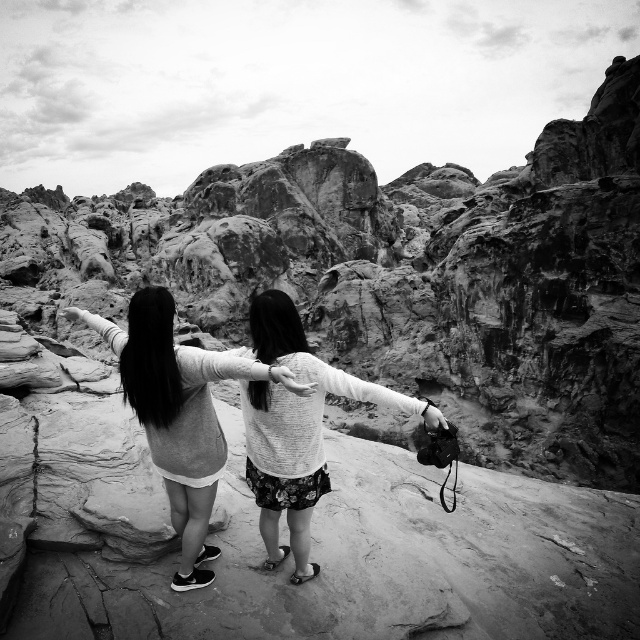
Is point (204, 400) farther from viewer compared to point (268, 496)?

No, (204, 400) is in front of (268, 496).

Does light gray sweater at center have a lesser width compared to fluffy white sweater at center?

No, light gray sweater at center is not thinner than fluffy white sweater at center.

Which is in front, point (202, 452) or point (317, 381)?

Positioned in front is point (202, 452).

At what (x,y) coordinates should I click in order to perform the action: click on light gray sweater at center. Please return your answer as a coordinate pair (x, y). This screenshot has width=640, height=640. Looking at the image, I should click on (179, 413).